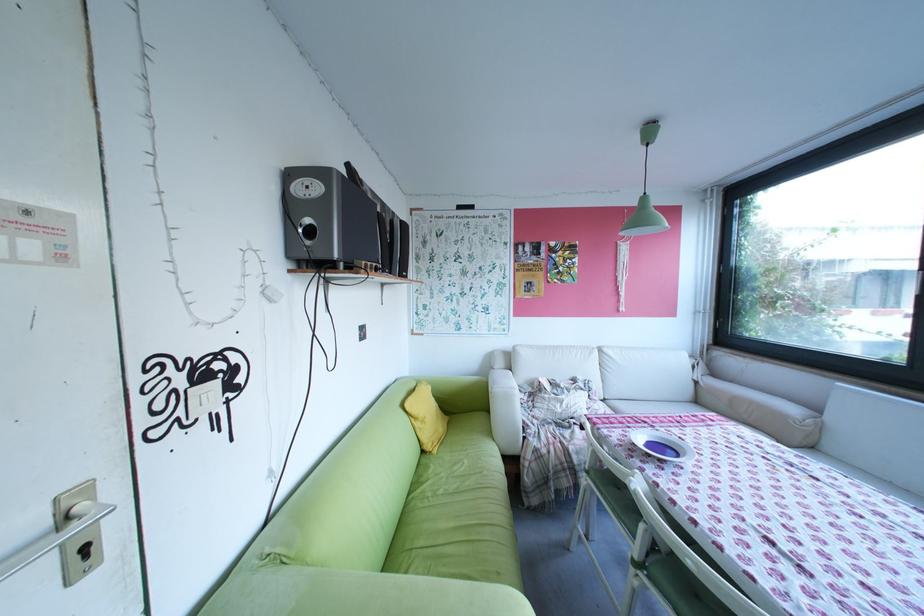
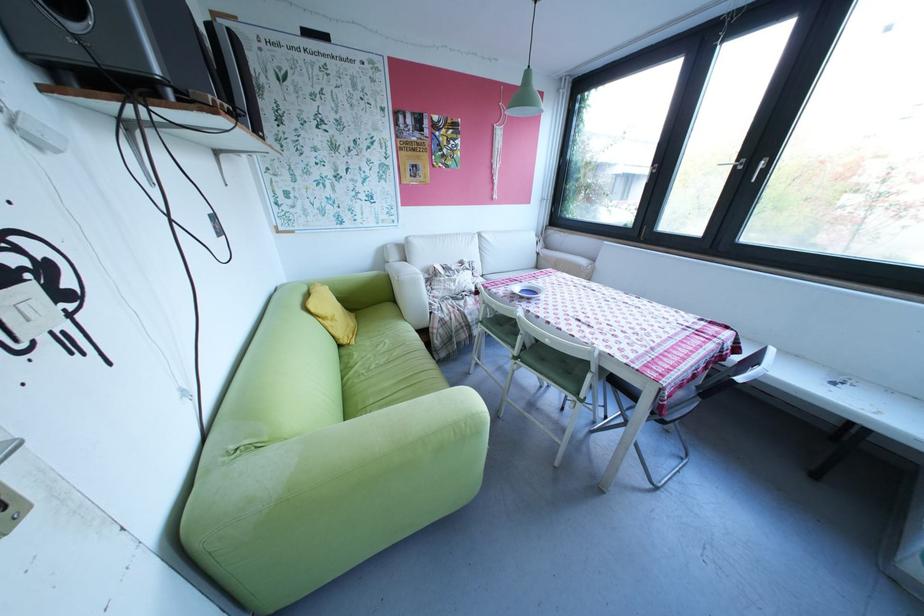
The point at (496, 379) is marked in the first image. Where is the corresponding point in the second image?

(395, 273)